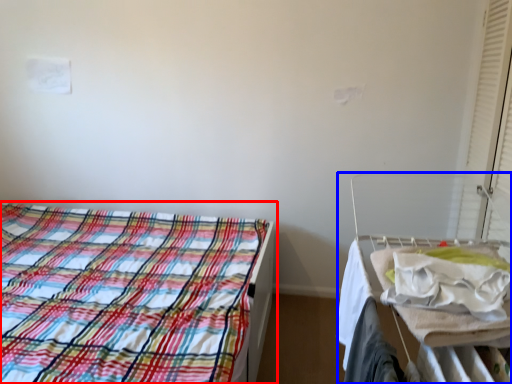
Question: Which object appears closest to the camera in this image, bed (highlighted by a red box) or hospital bed (highlighted by a blue box)?

Choices:
 (A) bed
 (B) hospital bed

Answer: (B)